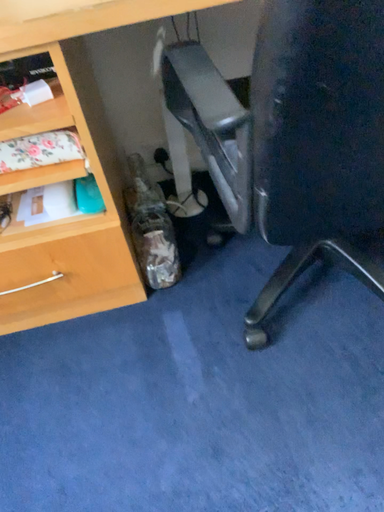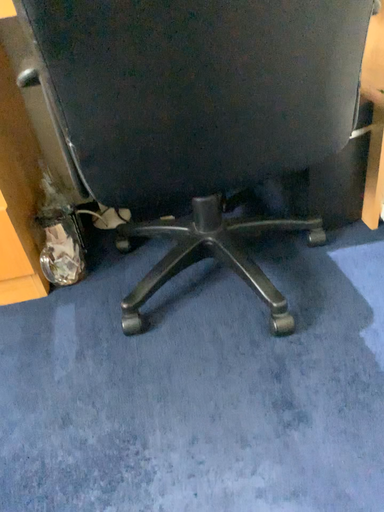
Question: How did the camera likely rotate when shooting the video?

Choices:
 (A) rotated downward
 (B) rotated upward

Answer: (B)